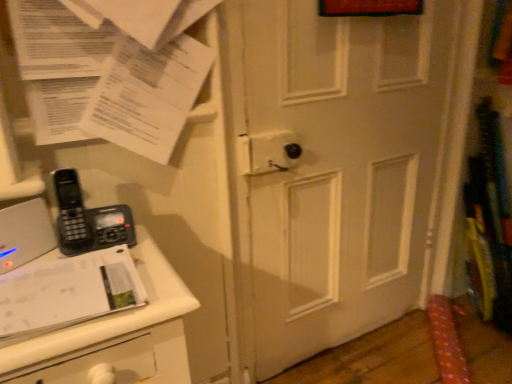
You are a GUI agent. You are given a task and a screenshot of the screen. Output one action in this format:
    pyautogui.click(x=<x>, y=<y>)
    Task: Click on the white plastic changing table at left
    Image resolution: width=512 pixels, height=384 pixels.
    Given the screenshot: What is the action you would take?
    pyautogui.click(x=116, y=335)

This screenshot has width=512, height=384. What do you see at coordinates (88, 219) in the screenshot?
I see `black plastic phone at left` at bounding box center [88, 219].

Image resolution: width=512 pixels, height=384 pixels. I want to click on white glossy journal at lower left, so click(x=67, y=293).

Find the location of a particular element. The height and width of the screenshot is (384, 512). white paper at upper left is located at coordinates (110, 77).

Is white matte door at center inside the boundaries of white glossy journal at lower left, or outside?

white matte door at center is located beyond the bounds of white glossy journal at lower left.

Would you say white matte door at center is to the left or to the right of white glossy journal at lower left in the picture?

Clearly, white matte door at center is on the right of white glossy journal at lower left in the image.

Which object is closer to the camera, white matte door at center or white glossy journal at lower left?

white glossy journal at lower left is closer to the camera.

How far apart are white matte door at center and white glossy journal at lower left?

A distance of 78.94 centimeters exists between white matte door at center and white glossy journal at lower left.

From the image's perspective, is white plastic changing table at left positioned above or below white glossy journal at lower left?

white plastic changing table at left is situated lower than white glossy journal at lower left in the image.

Locate an element on the screen. journal above the white plastic changing table at left (from a real-world perspective) is located at coordinates (67, 293).

Is white plastic changing table at left to the left of white glossy journal at lower left from the viewer's perspective?

No, white plastic changing table at left is not to the left of white glossy journal at lower left.

Does white plastic changing table at left have a larger size compared to white glossy journal at lower left?

Correct, white plastic changing table at left is larger in size than white glossy journal at lower left.

Consider the image. Considering the relative sizes of white plastic changing table at left and white paper at upper left in the image provided, is white plastic changing table at left smaller than white paper at upper left?

No, white plastic changing table at left is not smaller than white paper at upper left.

Is white plastic changing table at left facing away from white paper at upper left?

No, white plastic changing table at left is not facing the opposite direction of white paper at upper left.

Considering the points (153, 377) and (48, 106), which point is behind, point (153, 377) or point (48, 106)?

Point (48, 106)

Can you tell me how much white matte door at center and black plastic phone at left differ in facing direction?

The angle between the facing direction of white matte door at center and the facing direction of black plastic phone at left is 9.14 degrees.

Consider the image. In the image, is white matte door at center on the left side or the right side of black plastic phone at left?

In the image, white matte door at center appears on the right side of black plastic phone at left.

Identify the location of corded phone above the white matte door at center (from a real-world perspective). Image resolution: width=512 pixels, height=384 pixels. (88, 219).

Is white matte door at center positioned with its back to black plastic phone at left?

No, white matte door at center is not facing the opposite direction of black plastic phone at left.

Is the depth of white glossy journal at lower left less than that of white plastic changing table at left?

No, the depth of white glossy journal at lower left is greater than that of white plastic changing table at left.

Which point is more forward, (110, 279) or (75, 331)?

The point (75, 331) is in front.

From the picture: Considering the relative sizes of white glossy journal at lower left and white plastic changing table at left in the image provided, is white glossy journal at lower left wider than white plastic changing table at left?

No, white glossy journal at lower left is not wider than white plastic changing table at left.

Does point (126, 218) come in front of point (77, 48)?

No, it is behind (77, 48).

I want to click on document that is above the black plastic phone at left (from a real-world perspective), so pyautogui.click(x=110, y=77).

From the image's perspective, does black plastic phone at left appear lower than white paper at upper left?

Yes.

Considering the relative sizes of black plastic phone at left and white paper at upper left in the image provided, is black plastic phone at left wider than white paper at upper left?

Yes, black plastic phone at left is wider than white paper at upper left.

Considering the points (75, 35) and (106, 253), which point is behind, point (75, 35) or point (106, 253)?

Positioned behind is point (75, 35).

Could white glossy journal at lower left be considered to be inside white paper at upper left?

Definitely not — white glossy journal at lower left is not inside white paper at upper left.

Does white paper at upper left have a greater height compared to white glossy journal at lower left?

Indeed, white paper at upper left has a greater height compared to white glossy journal at lower left.

From the image's perspective, between white paper at upper left and white glossy journal at lower left, who is located below?

From the image's view, white glossy journal at lower left is below.

You are a GUI agent. You are given a task and a screenshot of the screen. Output one action in this format:
    pyautogui.click(x=<x>, y=<y>)
    Task: Click on the journal lying below the white matte door at center (from the image's perspective)
    Image resolution: width=512 pixels, height=384 pixels.
    Given the screenshot: What is the action you would take?
    pyautogui.click(x=67, y=293)

This screenshot has width=512, height=384. What are the coordinates of `journal above the white plastic changing table at left (from the image's perspective)` in the screenshot? It's located at (67, 293).

Which object lies further to the anchor point white matte door at center, white glossy journal at lower left or white plastic changing table at left?

white glossy journal at lower left lies further to white matte door at center than the other object.

When comparing their distances from white glossy journal at lower left, does white plastic changing table at left or black plastic phone at left seem closer?

The object closer to white glossy journal at lower left is white plastic changing table at left.

Which object lies further to the anchor point white plastic changing table at left, white matte door at center or white paper at upper left?

white matte door at center.

Estimate the real-world distances between objects in this image. Which object is closer to white paper at upper left, white matte door at center or black plastic phone at left?

Based on the image, black plastic phone at left appears to be nearer to white paper at upper left.

In the scene shown: Which object lies further to the anchor point black plastic phone at left, white plastic changing table at left or white matte door at center?

white matte door at center.

Which object lies nearer to the anchor point white paper at upper left, white matte door at center or white plastic changing table at left?

white plastic changing table at left lies closer to white paper at upper left than the other object.

Considering their positions, is white plastic changing table at left positioned closer to white glossy journal at lower left than white paper at upper left?

Based on the image, white plastic changing table at left appears to be nearer to white glossy journal at lower left.

Looking at the image, which one is located further to black plastic phone at left, white plastic changing table at left or white paper at upper left?

white paper at upper left lies further to black plastic phone at left than the other object.

At what (x,y) coordinates should I click in order to perform the action: click on document situated between white glossy journal at lower left and white matte door at center from left to right. Please return your answer as a coordinate pair (x, y). Looking at the image, I should click on (110, 77).

Image resolution: width=512 pixels, height=384 pixels. What are the coordinates of `document situated between black plastic phone at left and white matte door at center from left to right` in the screenshot? It's located at (110, 77).

The height and width of the screenshot is (384, 512). What are the coordinates of `document located between white plastic changing table at left and white matte door at center in the left-right direction` in the screenshot? It's located at (110, 77).

I want to click on corded phone between white paper at upper left and white glossy journal at lower left in the up-down direction, so click(x=88, y=219).